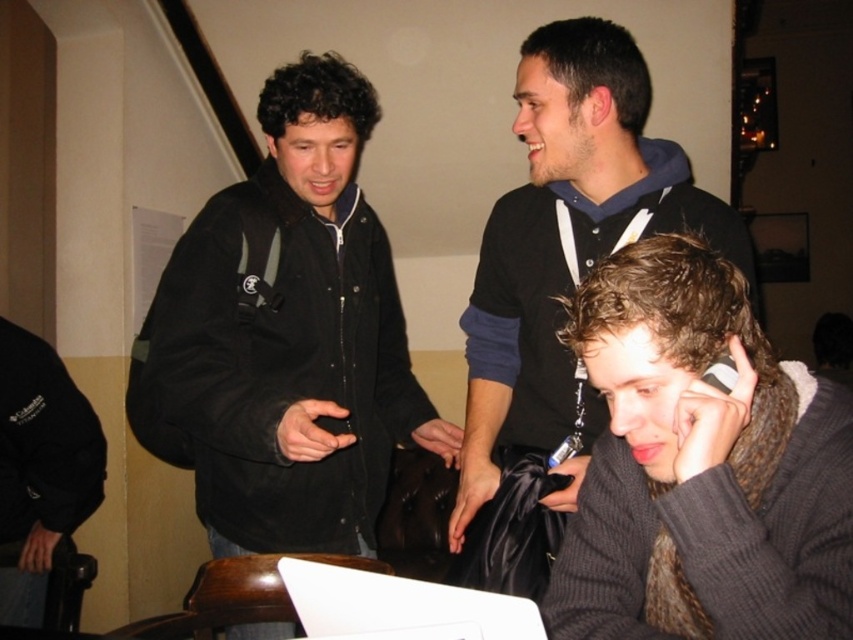
You are a photographer setting up a shoot in the described scene. You need to position a spotlight so that it illuminates both the black matte jacket at upper left and the dark gray knitted sweater at lower right without casting shadows over other areas. Considering their sizes, which object should you focus the spotlight on first to ensure adequate coverage?

The black matte jacket at upper left is much taller than the dark gray knitted sweater at lower right. Therefore, you should focus the spotlight on the black matte jacket at upper left first to ensure it receives sufficient illumination before adjusting for the smaller sweater.

You are standing in the room and want to locate the black hoodie at upper center. What are the coordinates where you should look?

The black hoodie at upper center is located at coordinates point (x=560, y=237).

Based on the photo, you are standing in the room and want to hand a document to both the person wearing the black matte jacket at upper left and the person wearing the dark gray knitted sweater at lower right. Which person should you approach first based on their positions?

You should approach the person wearing the black matte jacket at upper left first because they are closer to you than the dark gray knitted sweater at lower right, which is further away.